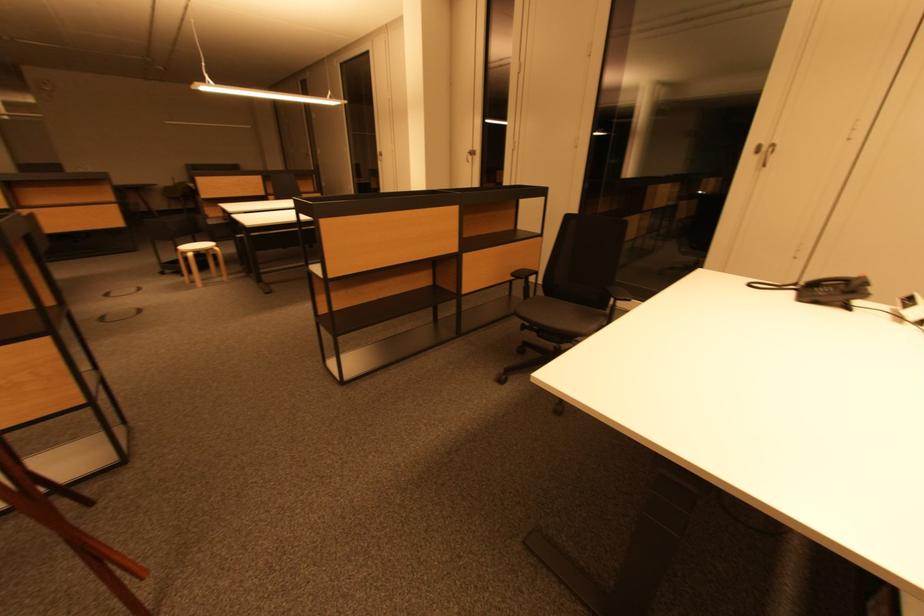
Locate an element on the screen. The width and height of the screenshot is (924, 616). black chair armrest is located at coordinates (524, 274).